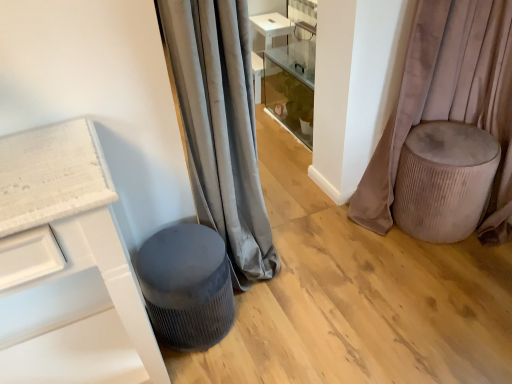
Locate an element on the screen. This screenshot has width=512, height=384. vacant space that's between gray velvet curtain at center, the 2th curtain when ordered from right to left, and velvet beige stool at right, the 2th curtain positioned from the left is located at coordinates (329, 234).